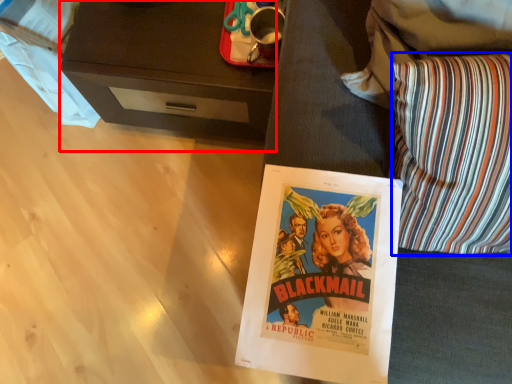
Question: Among these objects, which one is nearest to the camera, desk (highlighted by a red box) or throw pillow (highlighted by a blue box)?

Choices:
 (A) desk
 (B) throw pillow

Answer: (B)